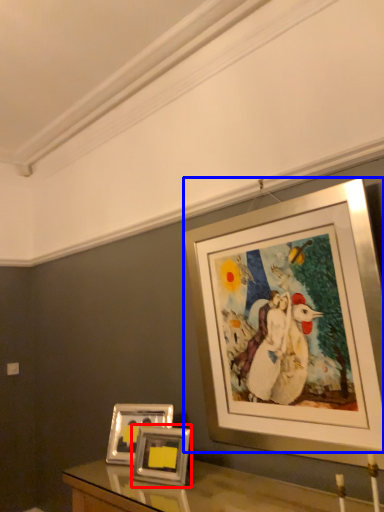
Question: Which of the following is the farthest to the observer, picture frame (highlighted by a red box) or picture frame (highlighted by a blue box)?

Choices:
 (A) picture frame
 (B) picture frame

Answer: (A)